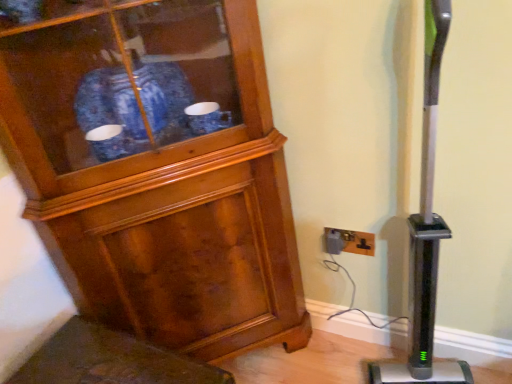
Question: Relative to black plastic outlet at lower right, is wooden cabinet at left in front or behind?

Choices:
 (A) behind
 (B) front

Answer: (B)

Question: Based on their sizes in the image, would you say wooden cabinet at left is bigger or smaller than black plastic outlet at lower right?

Choices:
 (A) big
 (B) small

Answer: (A)

Question: Visually, is wooden cabinet at left positioned to the left or to the right of black plastic outlet at lower right?

Choices:
 (A) right
 (B) left

Answer: (B)

Question: In terms of size, does black plastic outlet at lower right appear bigger or smaller than wooden cabinet at left?

Choices:
 (A) big
 (B) small

Answer: (B)

Question: Considering the positions of black plastic outlet at lower right and wooden cabinet at left in the image, is black plastic outlet at lower right wider or thinner than wooden cabinet at left?

Choices:
 (A) wide
 (B) thin

Answer: (B)

Question: From a real-world perspective, relative to wooden cabinet at left, is black plastic outlet at lower right vertically above or below?

Choices:
 (A) below
 (B) above

Answer: (A)

Question: From the image's perspective, is black plastic outlet at lower right positioned above or below wooden cabinet at left?

Choices:
 (A) below
 (B) above

Answer: (A)